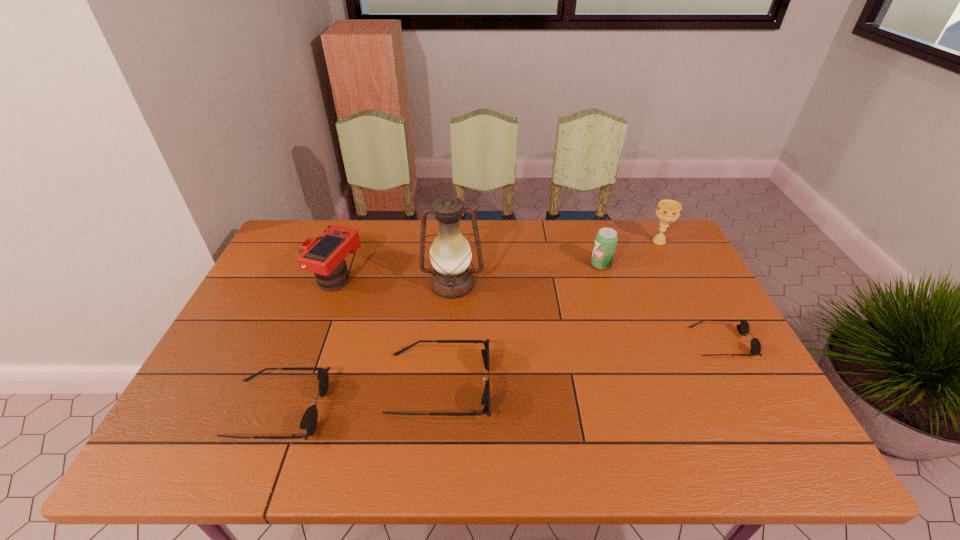
What are the coordinates of `free point between the chalice and the tallest object` in the screenshot? It's located at (556, 263).

The image size is (960, 540). Find the location of `vacant area that lies between the oil lamp and the soda`. vacant area that lies between the oil lamp and the soda is located at coordinates (527, 275).

Locate an element on the screen. Image resolution: width=960 pixels, height=540 pixels. empty space between the leftmost sunglasses and the soda is located at coordinates (440, 337).

Where is `free spot between the second shortest sunglasses and the oil lamp`? This screenshot has width=960, height=540. free spot between the second shortest sunglasses and the oil lamp is located at coordinates (365, 347).

Identify the location of free area in between the second shortest sunglasses and the camera. This screenshot has height=540, width=960. (307, 343).

Locate an element on the screen. This screenshot has height=540, width=960. vacant area that lies between the camera and the second sunglasses from left to right is located at coordinates (388, 332).

Identify the location of vacant space that is in between the camera and the chalice. (497, 260).

You are a GUI agent. You are given a task and a screenshot of the screen. Output one action in this format:
    pyautogui.click(x=<x>, y=<y>)
    Task: Click on the vacant area that lies between the shortest sunglasses and the camera
    The height and width of the screenshot is (540, 960).
    Given the screenshot: What is the action you would take?
    pyautogui.click(x=529, y=310)

This screenshot has width=960, height=540. I want to click on free spot between the shortest sunglasses and the camera, so click(x=529, y=310).

Where is `object that ranks as the fifth closest to the camera`? The image size is (960, 540). object that ranks as the fifth closest to the camera is located at coordinates (668, 211).